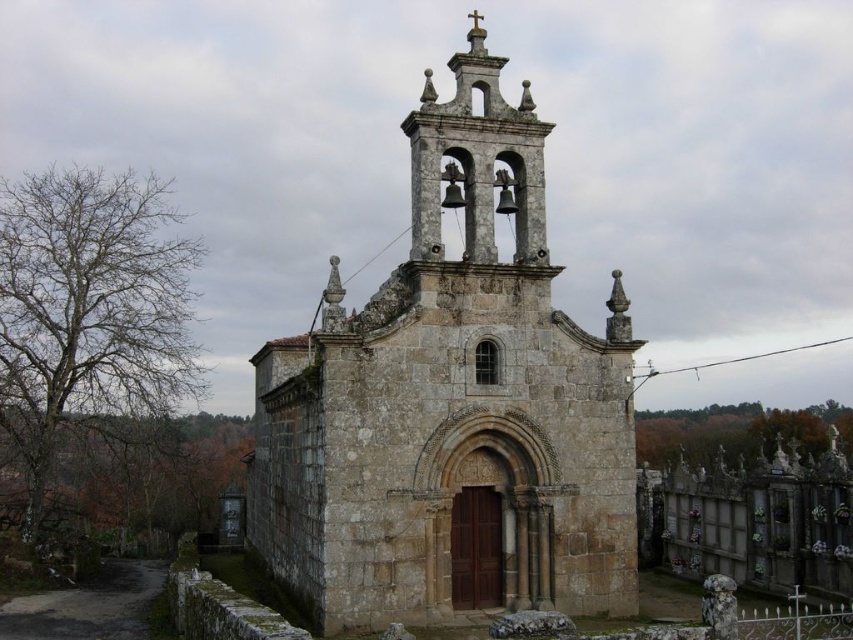
Question: Does rustic stone church at center have a larger size compared to stone bell tower at upper center?

Choices:
 (A) yes
 (B) no

Answer: (A)

Question: Can you confirm if rustic stone church at center is wider than stone bell tower at upper center?

Choices:
 (A) yes
 (B) no

Answer: (A)

Question: From the image, what is the correct spatial relationship of rustic stone church at center in relation to stone bell tower at upper center?

Choices:
 (A) right
 (B) left

Answer: (B)